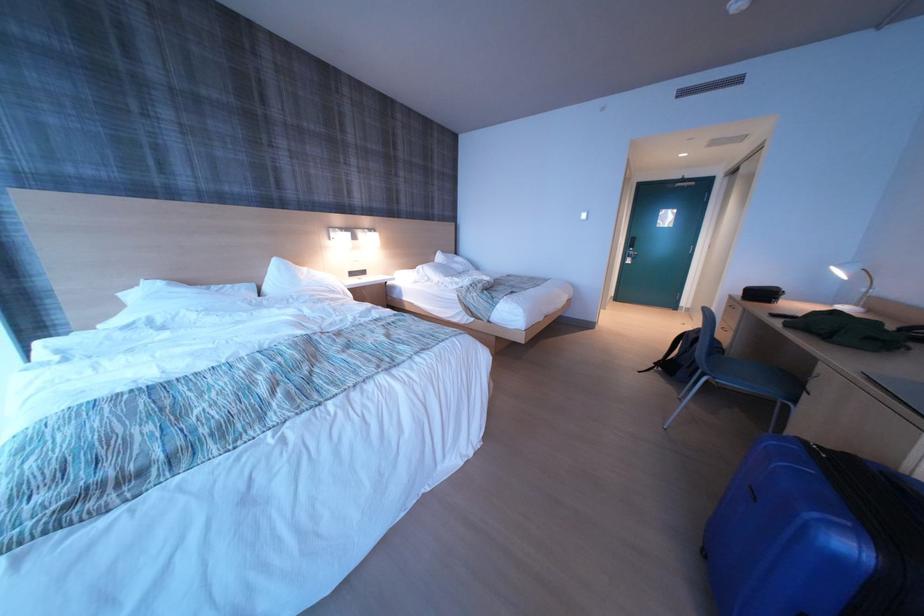
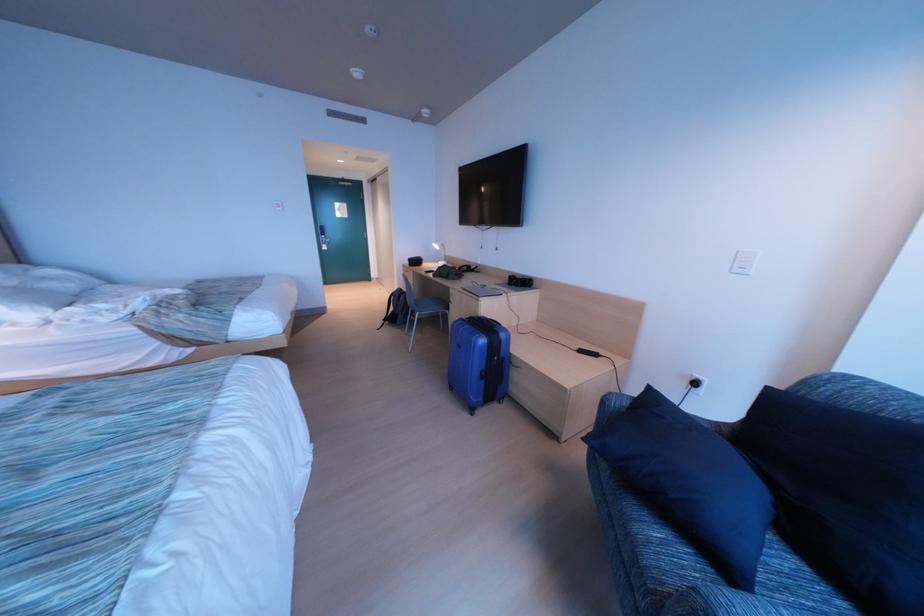
Question: How did the camera likely rotate?

Choices:
 (A) Left
 (B) Right
 (C) Up
 (D) Down

Answer: (B)